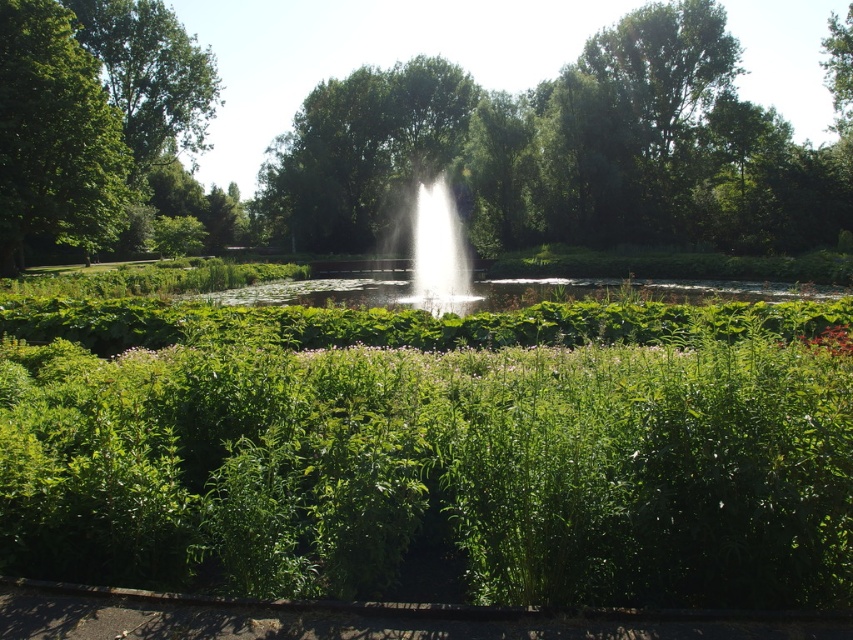
Describe the element at coordinates (54, 134) in the screenshot. This screenshot has height=640, width=853. I see `green leafy tree at left` at that location.

Does green leafy tree at left have a greater width compared to white water at center?

Indeed, green leafy tree at left has a greater width compared to white water at center.

Locate an element on the screen. The width and height of the screenshot is (853, 640). green leafy tree at left is located at coordinates coord(54,134).

Where is `green leafy tree at left`? The height and width of the screenshot is (640, 853). green leafy tree at left is located at coordinates (54, 134).

How much distance is there between green leafy hedge at center and white water at center?

33.59 feet

What do you see at coordinates (442, 451) in the screenshot?
I see `green leafy hedge at center` at bounding box center [442, 451].

Which is in front, point (6, 412) or point (424, 225)?

Point (6, 412)

Find the location of `green leafy hedge at center`. green leafy hedge at center is located at coordinates (442, 451).

Who is more distant from viewer, (672, 120) or (453, 300)?

Point (672, 120)

Can you confirm if green leafy tree at center is positioned below white water at center?

Incorrect, green leafy tree at center is not positioned below white water at center.

The width and height of the screenshot is (853, 640). I want to click on green leafy tree at center, so click(412, 144).